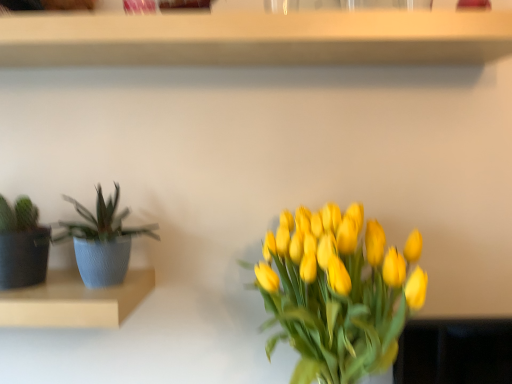
Where is `vacant area situated below blue textured pot at left (from a real-world perspective)`? The image size is (512, 384). vacant area situated below blue textured pot at left (from a real-world perspective) is located at coordinates (91, 289).